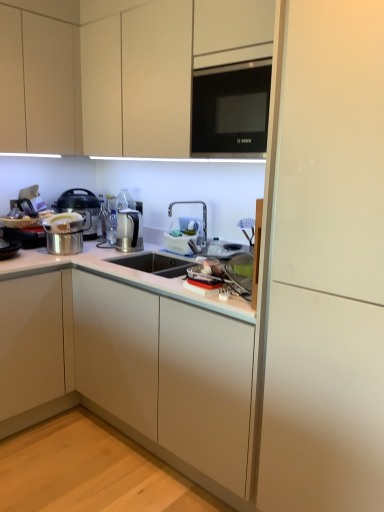
Question: Looking at the image, does white plastic basket at center seem bigger or smaller compared to white glossy cabinet at center, which appears as the 1th cabinetry when ordered from the bottom?

Choices:
 (A) big
 (B) small

Answer: (B)

Question: From their relative heights in the image, would you say white plastic basket at center is taller or shorter than white glossy cabinet at center, which appears as the 1th cabinetry when ordered from the bottom?

Choices:
 (A) short
 (B) tall

Answer: (A)

Question: Which object is the closest to the matte white cabinet at upper center, acting as the 1th cabinetry starting from the top?

Choices:
 (A) metallic silver pressure cooker at left
 (B) white matte cabinet at right
 (C) white glossy sink at center
 (D) white plastic basket at center
 (E) black glass microwave at upper center

Answer: (E)

Question: Which of these objects is positioned closest to the matte white cabinet at upper center, marked as the second cabinetry in a bottom-to-top arrangement?

Choices:
 (A) white plastic basket at center
 (B) satin silver coffee machine at center
 (C) white matte cabinet at right
 (D) white glossy cabinet at center, which appears as the 1th cabinetry when ordered from the bottom
 (E) white glossy sink at center

Answer: (E)